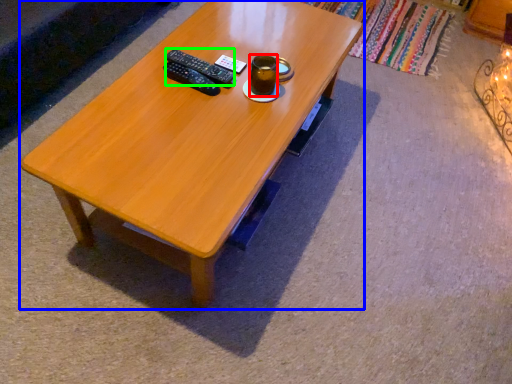
Question: Estimate the real-world distances between objects in this image. Which object is closer to beverage (highlighted by a red box), coffee table (highlighted by a blue box) or remote (highlighted by a green box)?

Choices:
 (A) coffee table
 (B) remote

Answer: (B)